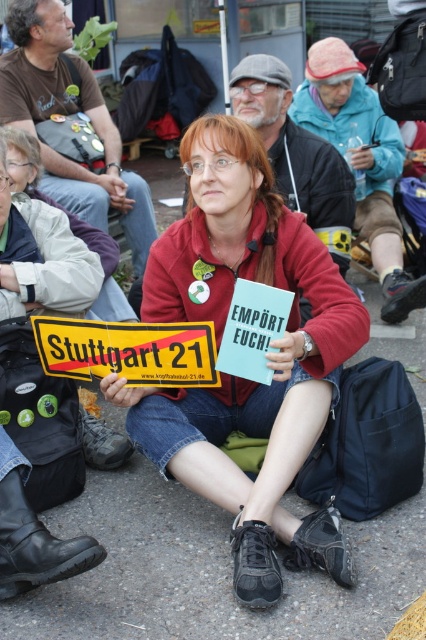
Question: Which point appears closest to the camera in this image?

Choices:
 (A) (215, 300)
 (B) (195, 384)

Answer: (B)

Question: Is matte red jacket at center closer to the viewer compared to yellowplastic/stickerstuttgart 21 sign at center?

Choices:
 (A) no
 (B) yes

Answer: (B)

Question: Is matte red jacket at center behind yellowplastic/stickerstuttgart 21 sign at center?

Choices:
 (A) yes
 (B) no

Answer: (B)

Question: Considering the relative positions of matte red jacket at center and yellowplastic/stickerstuttgart 21 sign at center in the image provided, where is matte red jacket at center located with respect to yellowplastic/stickerstuttgart 21 sign at center?

Choices:
 (A) right
 (B) left

Answer: (A)

Question: Which point appears closest to the camera in this image?

Choices:
 (A) tap(126, 349)
 (B) tap(172, 308)

Answer: (A)